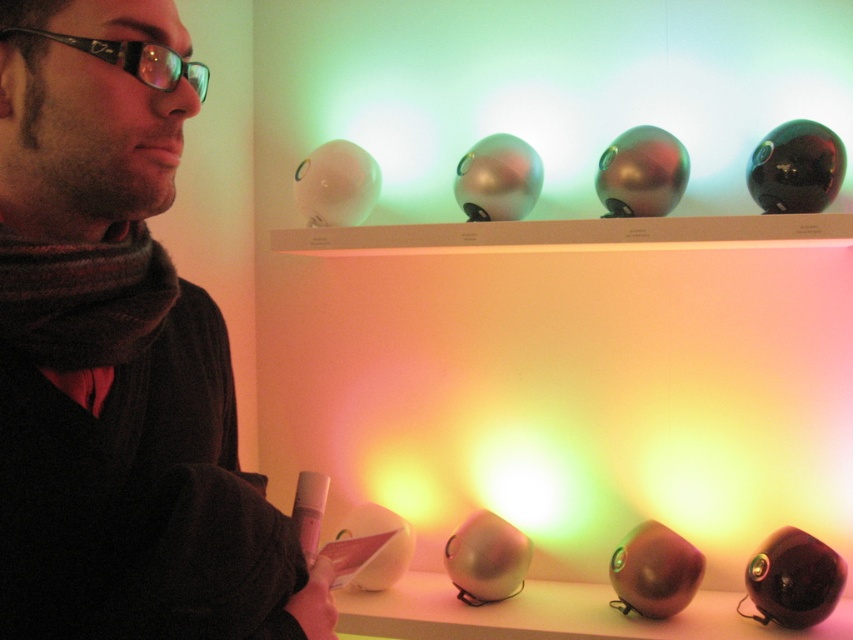
Question: Can you confirm if matte black scarf at left is positioned to the right of metallic silver sphere at lower center?

Choices:
 (A) yes
 (B) no

Answer: (B)

Question: Does knitted dark brown scarf at left appear over metallic silver sphere at lower center?

Choices:
 (A) no
 (B) yes

Answer: (B)

Question: From the image, what is the correct spatial relationship of metallic silver sphere at lower center in relation to black plastic glasses at upper left?

Choices:
 (A) left
 (B) right

Answer: (B)

Question: Based on their relative distances, which object is farther from the matte black scarf at left?

Choices:
 (A) black plastic glasses at upper left
 (B) metallic silver sphere at lower center
 (C) knitted dark brown scarf at left

Answer: (B)

Question: Considering the real-world distances, which object is farthest from the metallic silver sphere at lower center?

Choices:
 (A) black plastic glasses at upper left
 (B) matte black scarf at left

Answer: (A)

Question: Which of the following is the closest to the observer?

Choices:
 (A) (171, 76)
 (B) (708, 621)
 (C) (74, 346)

Answer: (A)